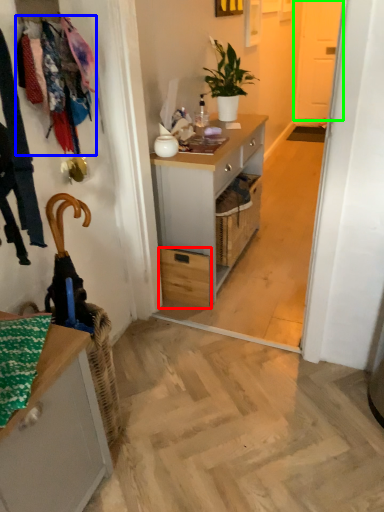
Question: Which object is positioned farthest from drawer (highlighted by a red box)? Select from clothesline (highlighted by a blue box) and screen door (highlighted by a green box).

Choices:
 (A) clothesline
 (B) screen door

Answer: (B)